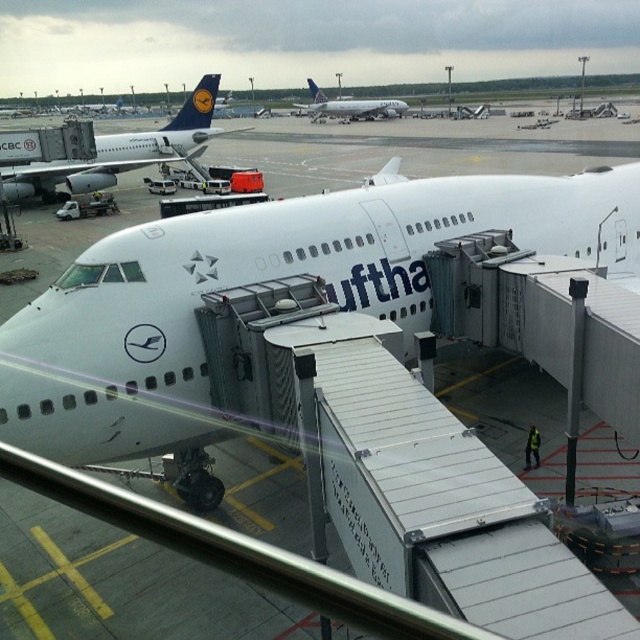
Question: Is white matte airplane at center to the right of white glossy airplane at center from the viewer's perspective?

Choices:
 (A) no
 (B) yes

Answer: (B)

Question: Which is nearer to the white glossy airplane at upper left?

Choices:
 (A) white matte airplane at center
 (B) white glossy airplane at center

Answer: (A)

Question: Can you confirm if white matte airplane at center is positioned to the right of white glossy airplane at center?

Choices:
 (A) no
 (B) yes

Answer: (B)

Question: Considering the real-world distances, which object is closest to the white matte airplane at center?

Choices:
 (A) white glossy airplane at upper left
 (B) white glossy airplane at center

Answer: (A)

Question: Does white matte airplane at center appear under white glossy airplane at center?

Choices:
 (A) no
 (B) yes

Answer: (B)

Question: Which of these objects is positioned closest to the white glossy airplane at upper left?

Choices:
 (A) white glossy airplane at center
 (B) white matte airplane at center

Answer: (B)